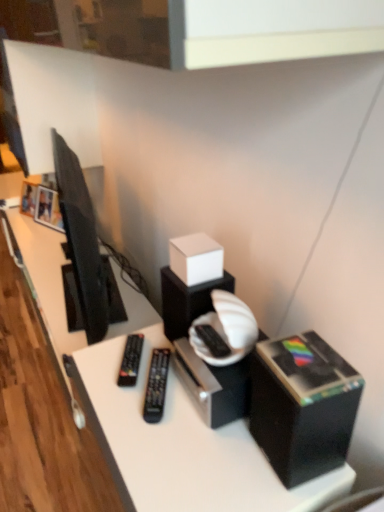
The height and width of the screenshot is (512, 384). Describe the element at coordinates (302, 406) in the screenshot. I see `black plastic box at lower right, the 2th box positioned from the back` at that location.

Measure the distance between point (199, 240) and camera.

Point (199, 240) and camera are 38.90 inches apart.

You are a GUI agent. You are given a task and a screenshot of the screen. Output one action in this format:
    pyautogui.click(x=<x>, y=<y>)
    Task: Click on the black plastic remote at center, acting as the 2th equipment starting from the left
    The width and height of the screenshot is (384, 512).
    Given the screenshot: What is the action you would take?
    click(156, 385)

Locate an element on the screen. Image resolution: width=384 pixels, height=512 pixels. black plastic box at lower right, the 2th box positioned from the back is located at coordinates (302, 406).

Is black plastic box at lower right, acting as the second box starting from the left, at the back of matte black television at left?

No.

What's the angular difference between matte black television at left and black plastic box at lower right, which is counted as the 1th box, starting from the front,'s facing directions?

The angle between the facing direction of matte black television at left and the facing direction of black plastic box at lower right, which is counted as the 1th box, starting from the front, is 4.42 degrees.

Can you confirm if matte black television at left is smaller than black plastic box at lower right, the first box positioned from the right?

No.

How much distance is there between matte black television at left and black plastic box at lower right, which is the first box in bottom-to-top order?

31.78 inches.

Is white matte cube at center, marked as the 2th box in a bottom-to-top arrangement, at the back of black plastic box at lower right, marked as the 2th box in a top-to-bottom arrangement?

black plastic box at lower right, marked as the 2th box in a top-to-bottom arrangement, is not turned away from white matte cube at center, marked as the 2th box in a bottom-to-top arrangement.

Is black plastic box at lower right, which is the first box in bottom-to-top order, located outside white matte cube at center, positioned as the 1th box in top-to-bottom order?

Yes, black plastic box at lower right, which is the first box in bottom-to-top order, is located beyond the bounds of white matte cube at center, positioned as the 1th box in top-to-bottom order.

Can you confirm if black plastic box at lower right, which is counted as the 1th box, starting from the front, is shorter than white matte cube at center, placed as the 2th box when sorted from front to back?

No, black plastic box at lower right, which is counted as the 1th box, starting from the front, is not shorter than white matte cube at center, placed as the 2th box when sorted from front to back.

Is point (302, 441) positioned behind point (171, 242)?

No, it is not.

Is matte black television at left taller than white matte cube at center, which is counted as the second box, starting from the right?

Indeed, matte black television at left has a greater height compared to white matte cube at center, which is counted as the second box, starting from the right.

Is matte black television at left next to white matte cube at center, placed as the 2th box when sorted from front to back?

No, matte black television at left is not making contact with white matte cube at center, placed as the 2th box when sorted from front to back.

Find the location of `television that appears behind the white matte cube at center, positioned as the 1th box in top-to-bottom order`. television that appears behind the white matte cube at center, positioned as the 1th box in top-to-bottom order is located at coordinates (81, 240).

Is black plastic box at lower right, acting as the second box starting from the left, not within black plastic remote at center, positioned as the first equipment in right-to-left order?

Yes, black plastic box at lower right, acting as the second box starting from the left, is outside of black plastic remote at center, positioned as the first equipment in right-to-left order.

From a real-world perspective, is black plastic box at lower right, the first box positioned from the right, physically located above or below black plastic remote at center, acting as the 2th equipment starting from the left?

black plastic box at lower right, the first box positioned from the right, is situated higher than black plastic remote at center, acting as the 2th equipment starting from the left, in the real world.

Is black plastic box at lower right, which is counted as the 1th box, starting from the front, facing towards black plastic remote at center, positioned as the first equipment in right-to-left order?

No.

Looking at this image, between black plastic remote at center, arranged as the 2th equipment when viewed from the right, and white matte cube at center, positioned as the 1th box in top-to-bottom order, which one has smaller width?

black plastic remote at center, arranged as the 2th equipment when viewed from the right.

Is black plastic remote at center, arranged as the 2th equipment when viewed from the right, oriented towards white matte cube at center, placed as the 2th box when sorted from front to back?

No, black plastic remote at center, arranged as the 2th equipment when viewed from the right, is not aimed at white matte cube at center, placed as the 2th box when sorted from front to back.

Is black plastic remote at center, which is counted as the first equipment, starting from the left, placed right next to white matte cube at center, marked as the 2th box in a bottom-to-top arrangement?

No, black plastic remote at center, which is counted as the first equipment, starting from the left, is not making contact with white matte cube at center, marked as the 2th box in a bottom-to-top arrangement.

Can you confirm if black plastic remote at center, arranged as the 2th equipment when viewed from the right, is smaller than white matte cube at center, positioned as the 1th box in top-to-bottom order?

Yes, black plastic remote at center, arranged as the 2th equipment when viewed from the right, is smaller than white matte cube at center, positioned as the 1th box in top-to-bottom order.

From their relative heights in the image, would you say white matte cube at center, placed as the first box when sorted from left to right, is taller or shorter than matte black television at left?

In the image, white matte cube at center, placed as the first box when sorted from left to right, appears to be shorter than matte black television at left.

From the image's perspective, is white matte cube at center, arranged as the first box when viewed from the back, under matte black television at left?

Yes.

Is white matte cube at center, placed as the 2th box when sorted from front to back, wider or thinner than matte black television at left?

Considering their sizes, white matte cube at center, placed as the 2th box when sorted from front to back, looks slimmer than matte black television at left.

Considering the positions of objects white matte cube at center, positioned as the 1th box in top-to-bottom order, and matte black television at left in the image provided, who is in front, white matte cube at center, positioned as the 1th box in top-to-bottom order, or matte black television at left?

white matte cube at center, positioned as the 1th box in top-to-bottom order, is more forward.

From a real-world perspective, which object rests below the other?

black plastic remote at center, which is counted as the first equipment, starting from the left.

From the image's perspective, between white matte cube at center, arranged as the first box when viewed from the back, and black plastic remote at center, arranged as the 2th equipment when viewed from the right, which one is located above?

white matte cube at center, arranged as the first box when viewed from the back.

Is white matte cube at center, which is counted as the second box, starting from the right, positioned with its back to black plastic remote at center, which is counted as the first equipment, starting from the left?

That's not correct — white matte cube at center, which is counted as the second box, starting from the right, is not looking away from black plastic remote at center, which is counted as the first equipment, starting from the left.

Which point is more forward, (x=211, y=262) or (x=128, y=367)?

The point (x=211, y=262) is closer.

I want to click on television above the black plastic box at lower right, the first box positioned from the right (from the image's perspective), so click(x=81, y=240).

Find the location of a particular element. This screenshot has height=512, width=384. box behind the black plastic box at lower right, marked as the 2th box in a top-to-bottom arrangement is located at coordinates (196, 258).

In the scene shown: Which object lies nearer to the anchor point black plastic remote at center, acting as the 2th equipment starting from the left, white matte cube at center, which is counted as the second box, starting from the right, or matte black television at left?

Among the two, white matte cube at center, which is counted as the second box, starting from the right, is located nearer to black plastic remote at center, acting as the 2th equipment starting from the left.

Which object lies further to the anchor point black plastic remote at center, which is counted as the first equipment, starting from the left, white matte cube at center, marked as the 2th box in a bottom-to-top arrangement, or matte black television at left?

The object further to black plastic remote at center, which is counted as the first equipment, starting from the left, is matte black television at left.

Considering their positions, is black plastic box at lower right, which is the first box in bottom-to-top order, positioned further to white matte cube at center, arranged as the first box when viewed from the back, than black plastic remote at center, which is counted as the first equipment, starting from the left?

Among the two, black plastic box at lower right, which is the first box in bottom-to-top order, is located further to white matte cube at center, arranged as the first box when viewed from the back.

Estimate the real-world distances between objects in this image. Which object is closer to black plastic box at lower right, which is the first box in bottom-to-top order, black plastic remote at center, acting as the 2th equipment starting from the left, or black plastic remote at center, which is counted as the first equipment, starting from the left?

black plastic remote at center, acting as the 2th equipment starting from the left, is positioned closer to the anchor black plastic box at lower right, which is the first box in bottom-to-top order.

Looking at the image, which one is located closer to black plastic remote at center, acting as the 2th equipment starting from the left, black plastic remote at center, which is counted as the first equipment, starting from the left, or white matte cube at center, which is counted as the second box, starting from the right?

black plastic remote at center, which is counted as the first equipment, starting from the left, is positioned closer to the anchor black plastic remote at center, acting as the 2th equipment starting from the left.

Considering their positions, is black plastic remote at center, arranged as the 2th equipment when viewed from the right, positioned closer to black plastic remote at center, acting as the 2th equipment starting from the left, than matte black television at left?

Among the two, black plastic remote at center, arranged as the 2th equipment when viewed from the right, is located nearer to black plastic remote at center, acting as the 2th equipment starting from the left.

Which object lies further to the anchor point white matte cube at center, positioned as the 1th box in top-to-bottom order, matte black television at left or black plastic remote at center, arranged as the 2th equipment when viewed from the right?

The object further to white matte cube at center, positioned as the 1th box in top-to-bottom order, is matte black television at left.

Which object lies further to the anchor point black plastic remote at center, arranged as the 2th equipment when viewed from the right, black plastic remote at center, acting as the 2th equipment starting from the left, or matte black television at left?

matte black television at left lies further to black plastic remote at center, arranged as the 2th equipment when viewed from the right, than the other object.

The width and height of the screenshot is (384, 512). I want to click on equipment between black plastic remote at center, which is counted as the first equipment, starting from the left, and black plastic box at lower right, which is the first box in bottom-to-top order, in the horizontal direction, so click(x=156, y=385).

The width and height of the screenshot is (384, 512). I want to click on box between matte black television at left and black plastic box at lower right, the first box positioned from the right, in the horizontal direction, so click(196, 258).

Locate an element on the screen. The width and height of the screenshot is (384, 512). equipment between matte black television at left and black plastic remote at center, positioned as the first equipment in right-to-left order, in the vertical direction is located at coordinates (131, 360).

The image size is (384, 512). What are the coordinates of `box between black plastic remote at center, which is counted as the first equipment, starting from the left, and black plastic box at lower right, the first box positioned from the right, from left to right` in the screenshot? It's located at (196, 258).